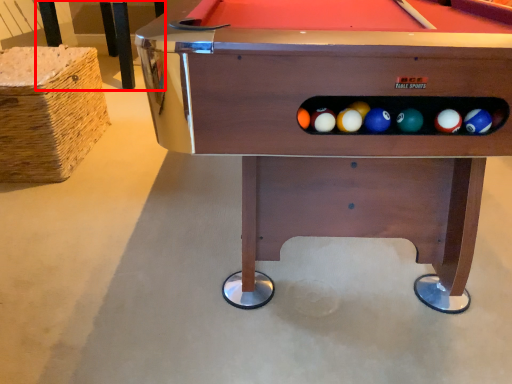
Question: From the image's perspective, what is the correct spatial positioning of table (annotated by the red box) in reference to billiard table?

Choices:
 (A) above
 (B) below

Answer: (A)